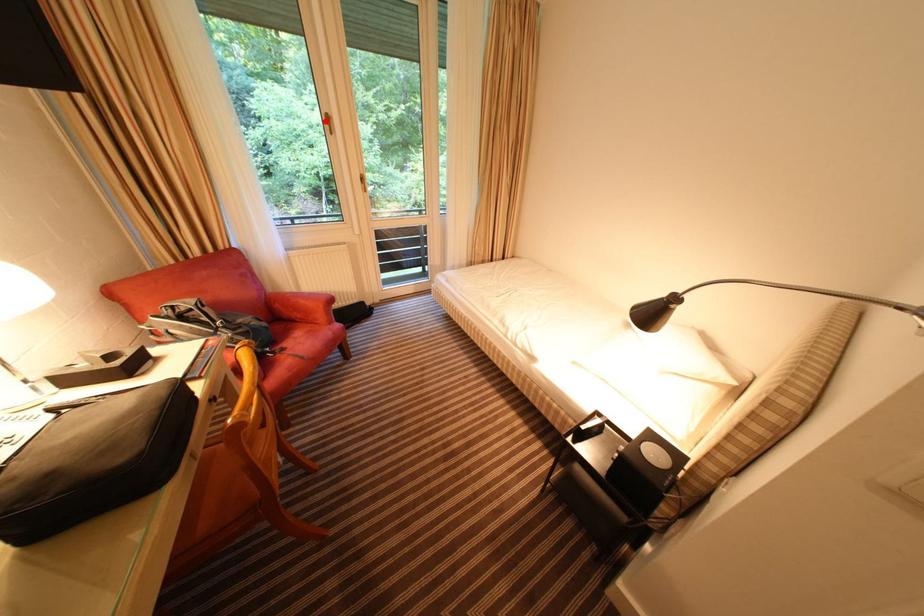
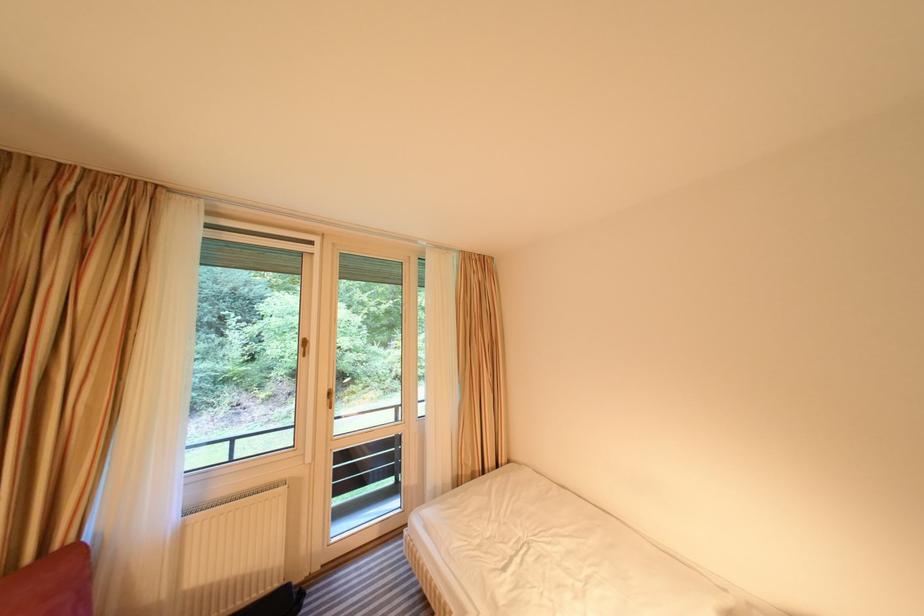
The point at the highlighted location is marked in the first image. Where is the corresponding point in the second image?

(300, 346)